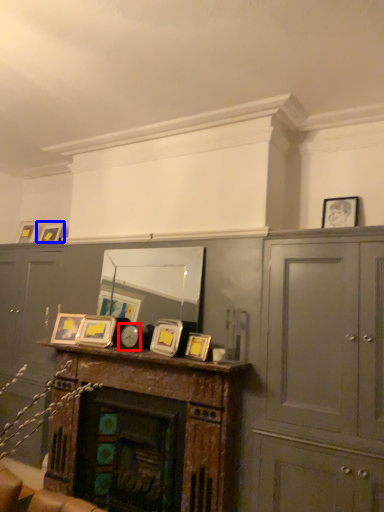
Question: Which of the following is the closest to the observer, clock (highlighted by a red box) or picture frame (highlighted by a blue box)?

Choices:
 (A) clock
 (B) picture frame

Answer: (A)